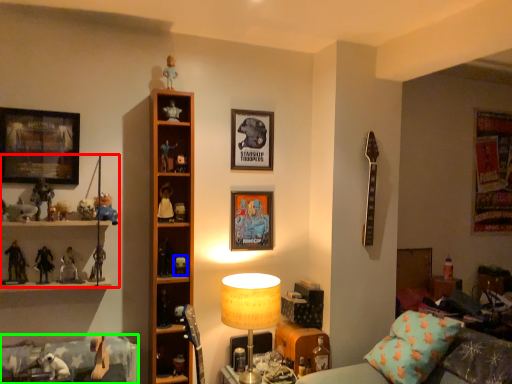
Question: Considering the real-world distances, which object is closest to collection (highlighted by a red box)? toy (highlighted by a blue box) or bed frame (highlighted by a green box).

Choices:
 (A) toy
 (B) bed frame

Answer: (B)